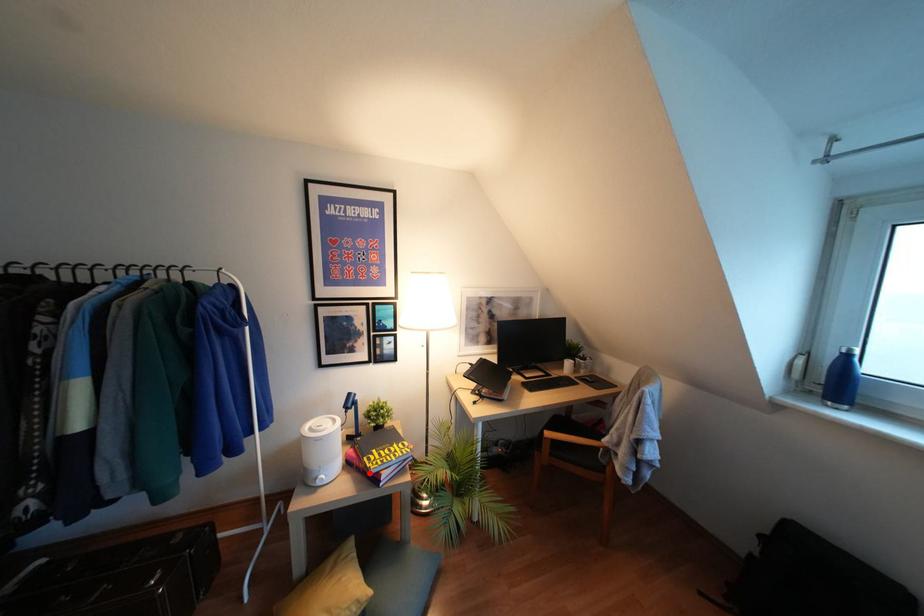
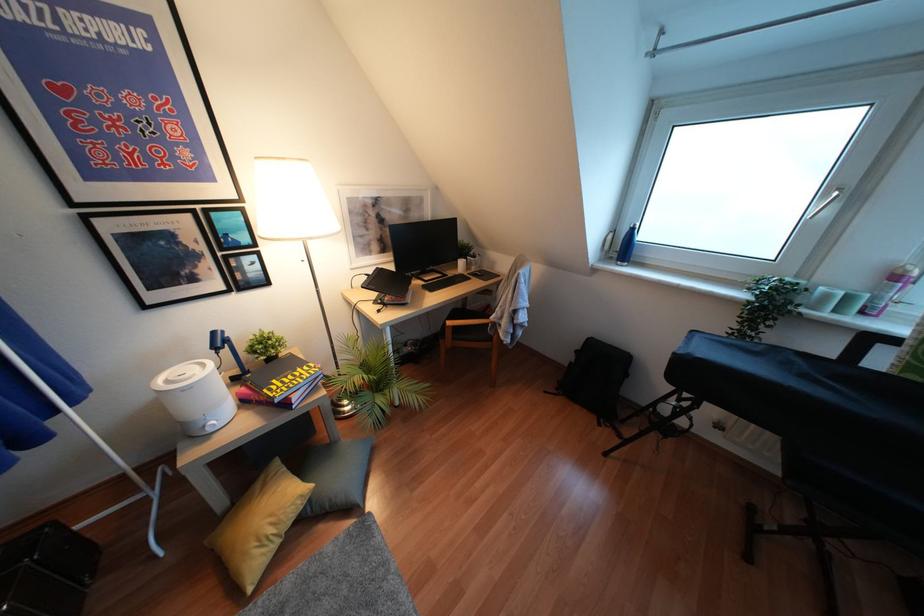
Locate, in the second image, the point that corresponds to the highlighted location in the first image.

(275, 400)